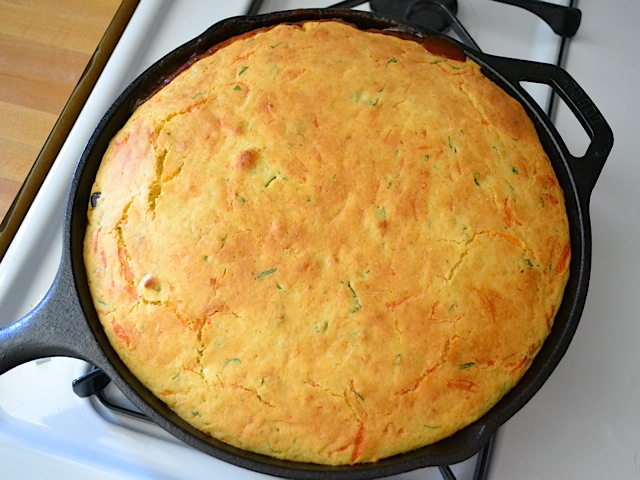
I want to click on black stovetop grate, so click(x=560, y=18).